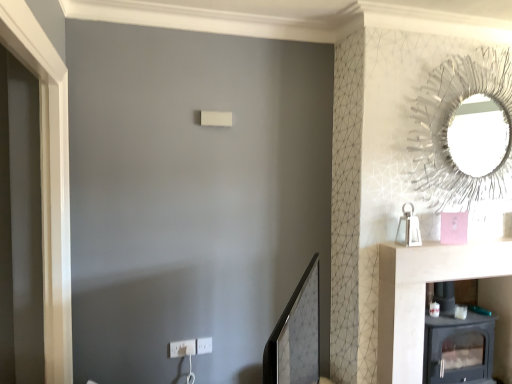
Question: Is metallic wire at upper right, positioned as the 2th mirror in bottom-to-top order, facing towards black matte wood stove at lower right?

Choices:
 (A) no
 (B) yes

Answer: (A)

Question: Is metallic wire at upper right, which appears as the 1th mirror when viewed from the back, facing away from black matte wood stove at lower right?

Choices:
 (A) no
 (B) yes

Answer: (A)

Question: Considering the relative sizes of metallic wire at upper right, positioned as the 2th mirror in bottom-to-top order, and black matte wood stove at lower right in the image provided, is metallic wire at upper right, positioned as the 2th mirror in bottom-to-top order, bigger than black matte wood stove at lower right?

Choices:
 (A) no
 (B) yes

Answer: (A)

Question: Does metallic wire at upper right, positioned as the 2th mirror in bottom-to-top order, have a smaller size compared to black matte wood stove at lower right?

Choices:
 (A) yes
 (B) no

Answer: (A)

Question: Is metallic wire at upper right, positioned as the 2th mirror in bottom-to-top order, positioned beyond the bounds of black matte wood stove at lower right?

Choices:
 (A) yes
 (B) no

Answer: (A)

Question: Is black matte wood stove at lower right wider or thinner than metallic wire at upper right, acting as the 1th mirror starting from the top?

Choices:
 (A) thin
 (B) wide

Answer: (B)

Question: Considering their positions, is black matte wood stove at lower right located in front of or behind metallic wire at upper right, positioned as the 2th mirror in bottom-to-top order?

Choices:
 (A) front
 (B) behind

Answer: (B)

Question: Is black matte wood stove at lower right bigger or smaller than metallic wire at upper right, acting as the 1th mirror starting from the top?

Choices:
 (A) small
 (B) big

Answer: (B)

Question: Is black matte wood stove at lower right spatially inside metallic wire at upper right, placed as the second mirror when sorted from front to back, or outside of it?

Choices:
 (A) inside
 (B) outside

Answer: (B)

Question: Do you think white plastic electric outlet at lower center, marked as the first electric outlet in a left-to-right arrangement, is within metallic wire at upper right, which appears as the 1th mirror when viewed from the back, or outside of it?

Choices:
 (A) inside
 (B) outside

Answer: (B)

Question: Relative to metallic wire at upper right, the 2th mirror when ordered from left to right, is white plastic electric outlet at lower center, marked as the first electric outlet in a left-to-right arrangement, in front or behind?

Choices:
 (A) front
 (B) behind

Answer: (B)

Question: In terms of size, does white plastic electric outlet at lower center, which is counted as the 2th electric outlet, starting from the right, appear bigger or smaller than metallic wire at upper right, which appears as the 1th mirror when viewed from the back?

Choices:
 (A) big
 (B) small

Answer: (B)

Question: From a real-world perspective, relative to metallic wire at upper right, positioned as the 2th mirror in bottom-to-top order, is white plastic electric outlet at lower center, marked as the first electric outlet in a left-to-right arrangement, vertically above or below?

Choices:
 (A) above
 (B) below

Answer: (B)

Question: In the image, is metallic wire at upper right, acting as the 1th mirror starting from the top, positioned in front of or behind white plastic electric outlet at lower center, acting as the 2th electric outlet starting from the left?

Choices:
 (A) behind
 (B) front

Answer: (B)

Question: Does point (501, 64) appear closer or farther from the camera than point (201, 349)?

Choices:
 (A) closer
 (B) farther

Answer: (B)